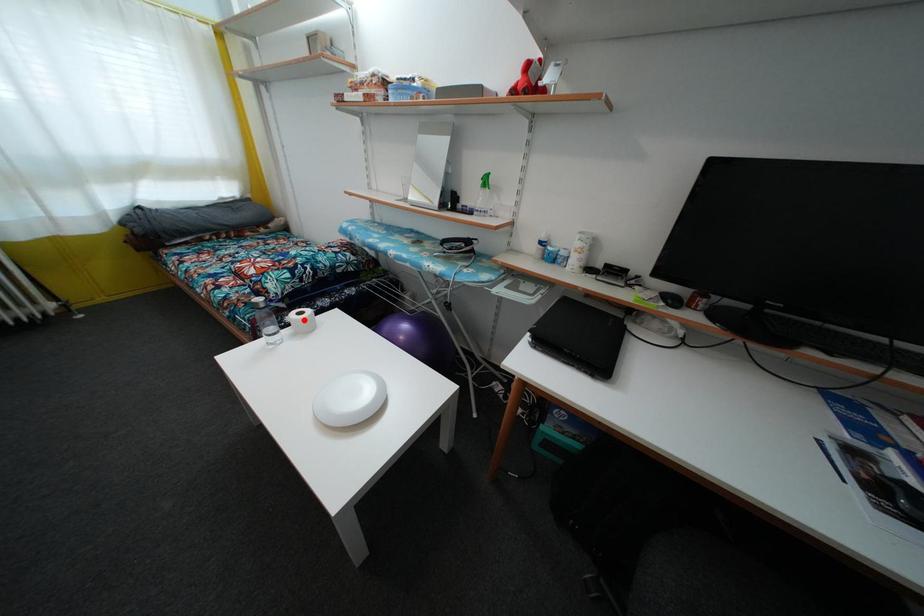
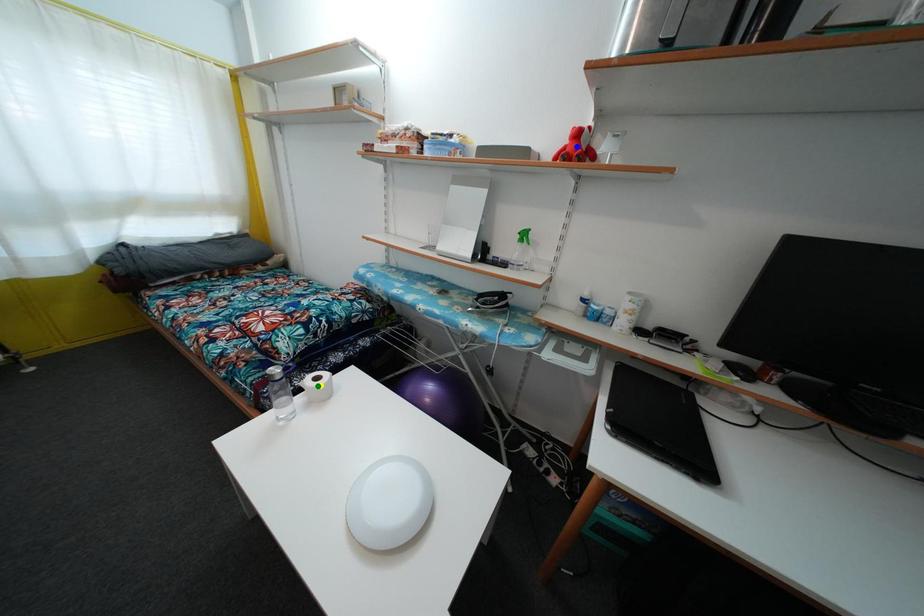
Question: I am providing you with two images of the same scene from different viewpoints. A red point is marked on the first image. You are given multiple points on the second image. In image 2, which mark is for the same physical point as the one in image 1?

Choices:
 (A) blue point
 (B) yellow point
 (C) green point

Answer: (B)